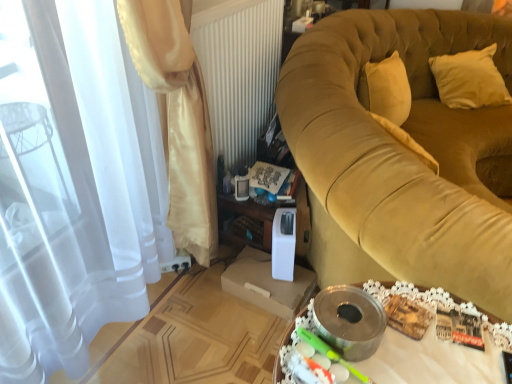
Question: Is metallic silver tray at lower center further to camera compared to velvet gold couch at right?

Choices:
 (A) no
 (B) yes

Answer: (A)

Question: Is metallic silver tray at lower center wider than velvet gold couch at right?

Choices:
 (A) yes
 (B) no

Answer: (B)

Question: Is metallic silver tray at lower center outside velvet gold couch at right?

Choices:
 (A) no
 (B) yes

Answer: (B)

Question: Considering the relative sizes of metallic silver tray at lower center and velvet gold couch at right in the image provided, is metallic silver tray at lower center thinner than velvet gold couch at right?

Choices:
 (A) yes
 (B) no

Answer: (A)

Question: From the image's perspective, is metallic silver tray at lower center beneath velvet gold couch at right?

Choices:
 (A) no
 (B) yes

Answer: (B)

Question: From a real-world perspective, relative to satin curtain at left, which appears as the 1th curtain when viewed from the back, is metallic silver tray at lower center vertically above or below?

Choices:
 (A) above
 (B) below

Answer: (B)

Question: Looking at the image, does metallic silver tray at lower center seem bigger or smaller compared to satin curtain at left, which appears as the 1th curtain when viewed from the back?

Choices:
 (A) small
 (B) big

Answer: (A)

Question: From the image's perspective, is metallic silver tray at lower center positioned above or below satin curtain at left, which appears as the 1th curtain when viewed from the back?

Choices:
 (A) above
 (B) below

Answer: (B)

Question: Would you say metallic silver tray at lower center is inside or outside satin curtain at left, the second curtain positioned from the front?

Choices:
 (A) outside
 (B) inside

Answer: (A)

Question: From the image's perspective, is satin curtain at left, which appears as the 1th curtain when viewed from the back, positioned above or below beige fabric pillow at upper right?

Choices:
 (A) above
 (B) below

Answer: (B)

Question: In the image, is satin curtain at left, the second curtain positioned from the front, positioned in front of or behind beige fabric pillow at upper right?

Choices:
 (A) front
 (B) behind

Answer: (A)

Question: Do you think satin curtain at left, which appears as the 1th curtain when viewed from the back, is within beige fabric pillow at upper right, or outside of it?

Choices:
 (A) outside
 (B) inside

Answer: (A)

Question: Considering the positions of point (200, 163) and point (442, 61), is point (200, 163) closer or farther from the camera than point (442, 61)?

Choices:
 (A) farther
 (B) closer

Answer: (B)

Question: In the image, is satin curtain at left, the second curtain when ordered from back to front, on the left side or the right side of satin curtain at left, which appears as the 1th curtain when viewed from the back?

Choices:
 (A) right
 (B) left

Answer: (B)

Question: Is satin curtain at left, which ranks as the 1th curtain in front-to-back order, bigger or smaller than satin curtain at left, which appears as the 1th curtain when viewed from the back?

Choices:
 (A) big
 (B) small

Answer: (A)